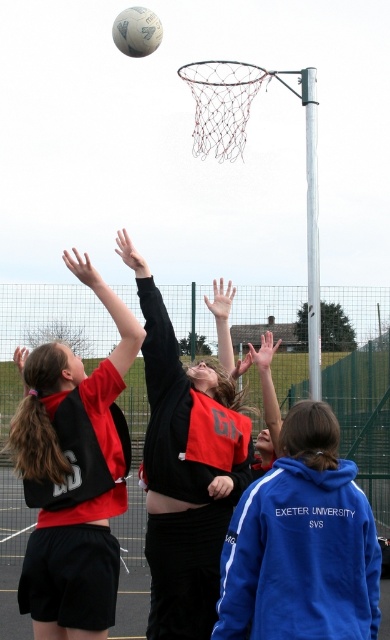
Does blue fleece jacket at lower right have a larger size compared to black jersey at upper left?

No, blue fleece jacket at lower right is not bigger than black jersey at upper left.

This screenshot has width=390, height=640. What do you see at coordinates (301, 544) in the screenshot?
I see `blue fleece jacket at lower right` at bounding box center [301, 544].

Between point (283, 499) and point (58, 468), which one is positioned in front?

Point (283, 499)

You are a GUI agent. You are given a task and a screenshot of the screen. Output one action in this format:
    pyautogui.click(x=<x>, y=<y>)
    Task: Click on the blue fleece jacket at lower right
    The width and height of the screenshot is (390, 640).
    Given the screenshot: What is the action you would take?
    pyautogui.click(x=301, y=544)

Does black jersey at upper left appear under white matte volleyball at upper center?

Yes, black jersey at upper left is below white matte volleyball at upper center.

In the scene shown: Is black jersey at upper left positioned behind white matte volleyball at upper center?

That is False.

Is point (138, 348) farther from viewer compared to point (152, 35)?

No, (138, 348) is closer to viewer.

Where is `black jersey at upper left`? The image size is (390, 640). black jersey at upper left is located at coordinates (74, 387).

Is point (248, 580) positioned after point (221, 419)?

No, it is in front of (221, 419).

Identify the location of blue fleece jacket at lower right. Image resolution: width=390 pixels, height=640 pixels. (301, 544).

The height and width of the screenshot is (640, 390). Identify the location of blue fleece jacket at lower right. (301, 544).